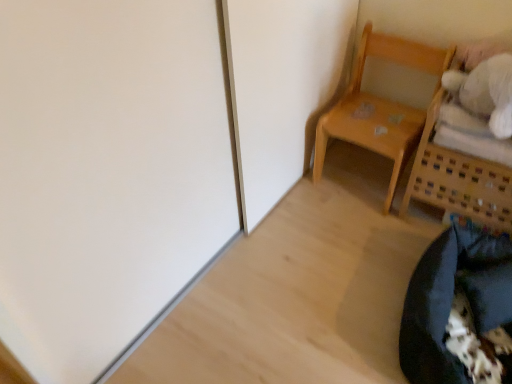
At what (x,y) coordinates should I click in order to perform the action: click on free space that is to the left of light wood chair at upper right, which is the second furniture in right-to-left order. Please return your answer as a coordinate pair (x, y). The image size is (512, 384). Looking at the image, I should click on (301, 198).